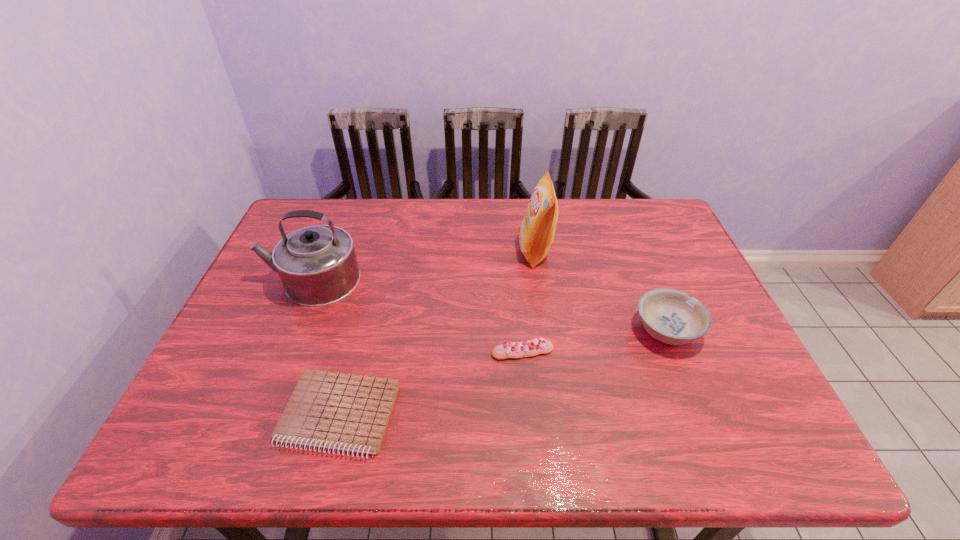
The width and height of the screenshot is (960, 540). I want to click on free space between the crisp (potato chip) and the notebook, so click(438, 333).

Find the location of `vacant area that lies between the kettle and the shortest object`. vacant area that lies between the kettle and the shortest object is located at coordinates (325, 347).

Locate an element on the screen. The image size is (960, 540). free area in between the kettle and the crisp (potato chip) is located at coordinates (423, 266).

Identify which object is the third closest to the kettle. Please provide its 2D coordinates. Your answer should be formatted as a tuple, i.e. [(x, y)], where the tuple contains the x and y coordinates of a point satisfying the conditions above.

[(536, 232)]

Locate an element on the screen. object that is the third closest to the third tallest object is located at coordinates (346, 412).

Identify the location of vacant space that satisfies the following two spatial constraints: 1. on the back side of the notebook; 2. with the spout at the front of the kettle. This screenshot has width=960, height=540. (374, 280).

You are a GUI agent. You are given a task and a screenshot of the screen. Output one action in this format:
    pyautogui.click(x=<x>, y=<y>)
    Task: Click on the free point that satisfies the following two spatial constraints: 1. with the spout at the front of the kettle; 2. on the left side of the third shortest object
    The width and height of the screenshot is (960, 540).
    Given the screenshot: What is the action you would take?
    pyautogui.click(x=291, y=330)

Image resolution: width=960 pixels, height=540 pixels. What are the coordinates of `free spot that satisfies the following two spatial constraints: 1. on the back side of the rightmost object; 2. on the right side of the eclair` in the screenshot? It's located at (520, 330).

Locate an element on the screen. The width and height of the screenshot is (960, 540). free location that satisfies the following two spatial constraints: 1. on the front-facing side of the crisp (potato chip); 2. on the back side of the rightmost object is located at coordinates (547, 330).

The image size is (960, 540). Identify the location of free space in the image that satisfies the following two spatial constraints: 1. on the back side of the shortest object; 2. on the right side of the fourth tallest object. (356, 352).